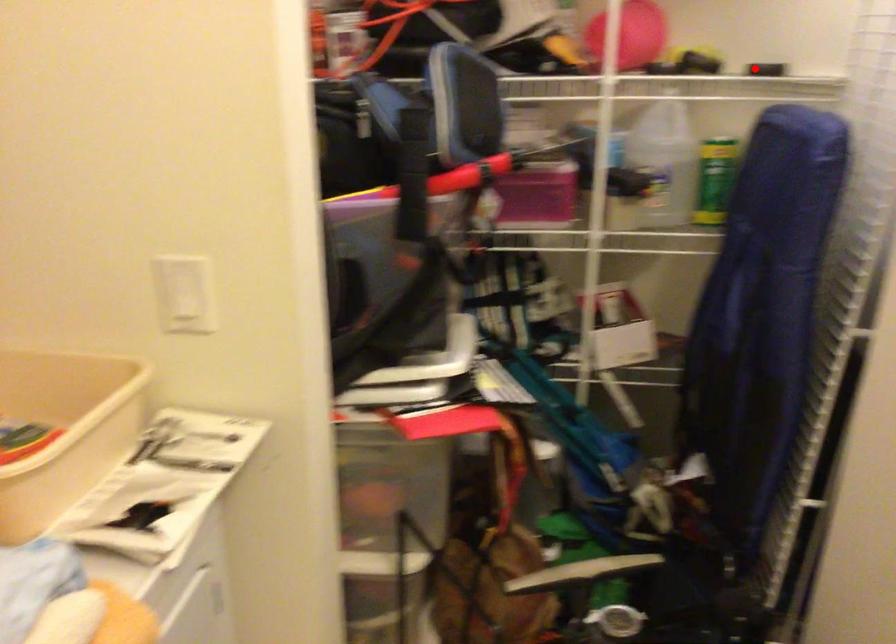
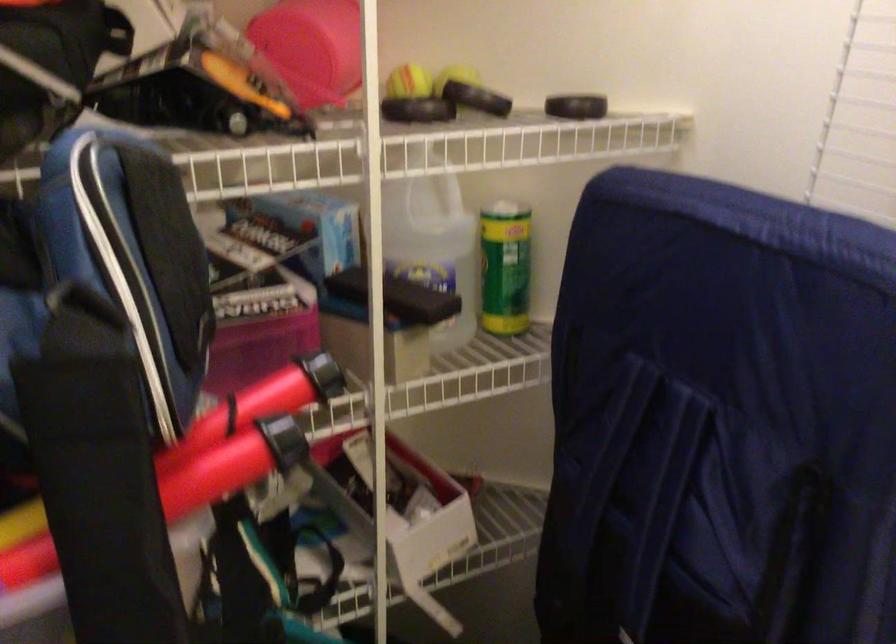
Locate, in the second image, the point that corresponds to the highlighted location in the first image.

(576, 106)